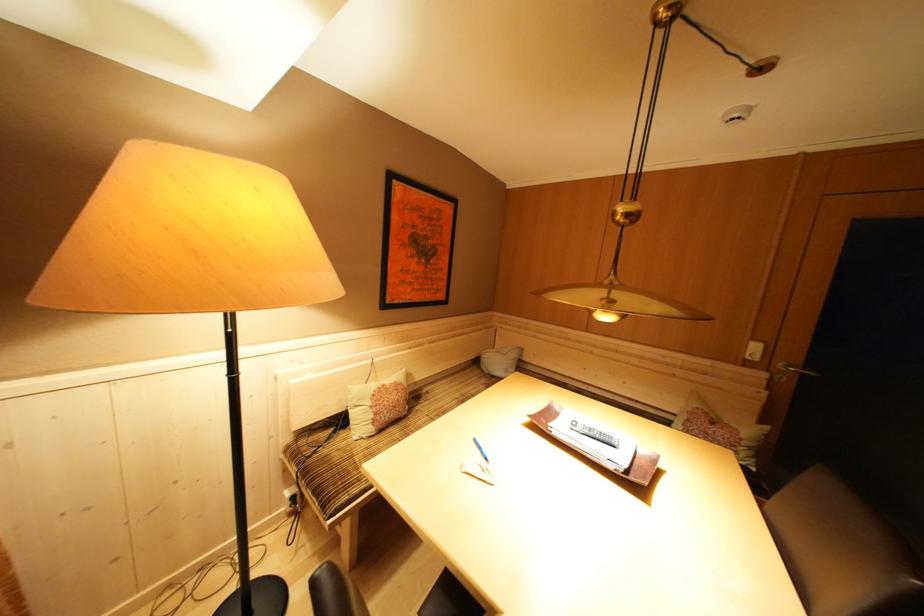
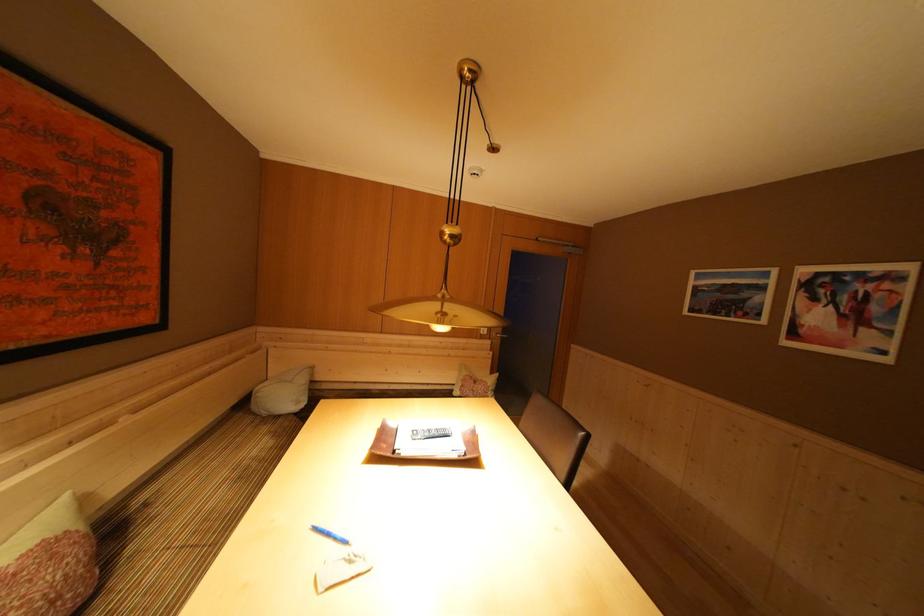
Question: The first image is from the beginning of the video and the second image is from the end. How did the camera likely rotate when shooting the video?

Choices:
 (A) Left
 (B) Right
 (C) Up
 (D) Down

Answer: (B)